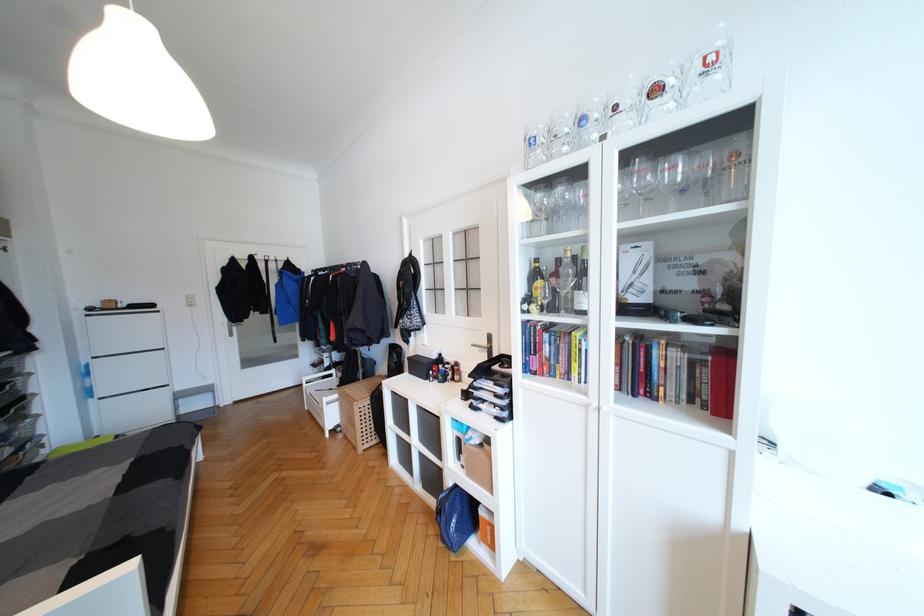
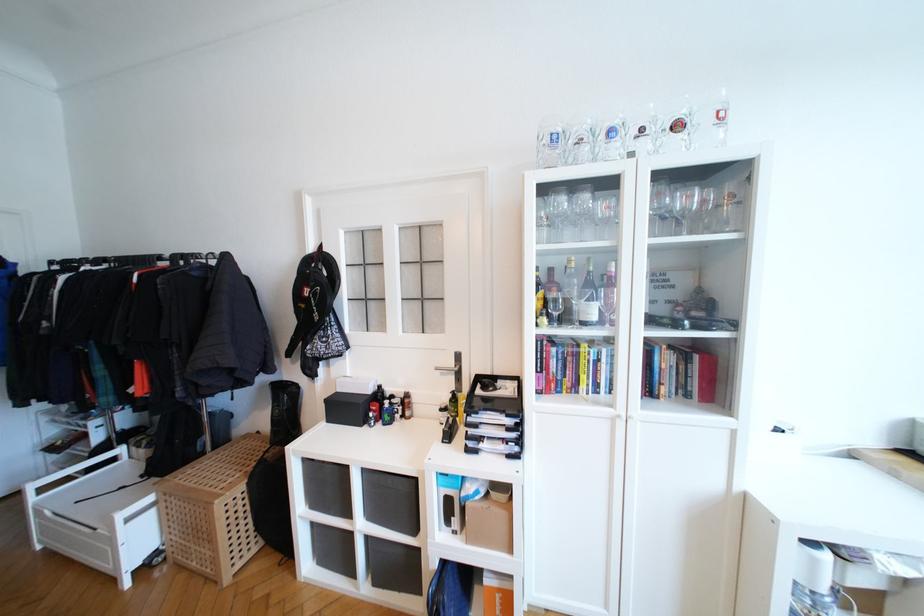
Where in the second image is the point corresponding to pixel 679 171 from the first image?

(691, 200)